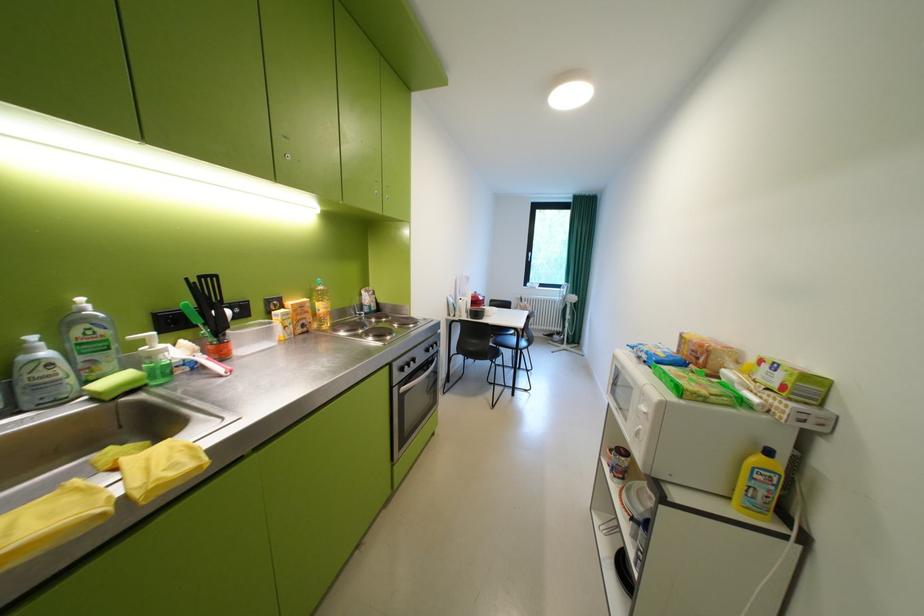
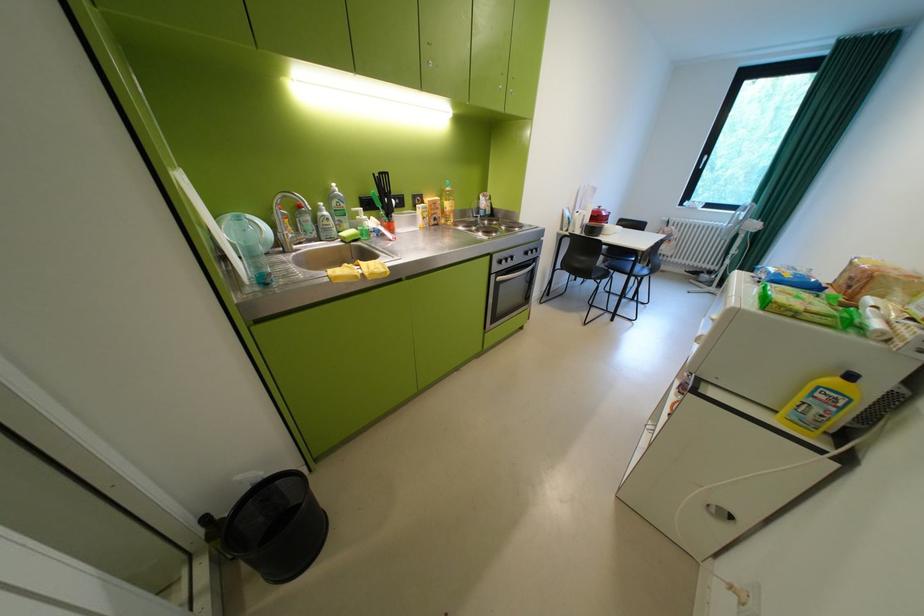
Find the pixel in the second image that matches (x=119, y=338) in the first image.

(356, 209)